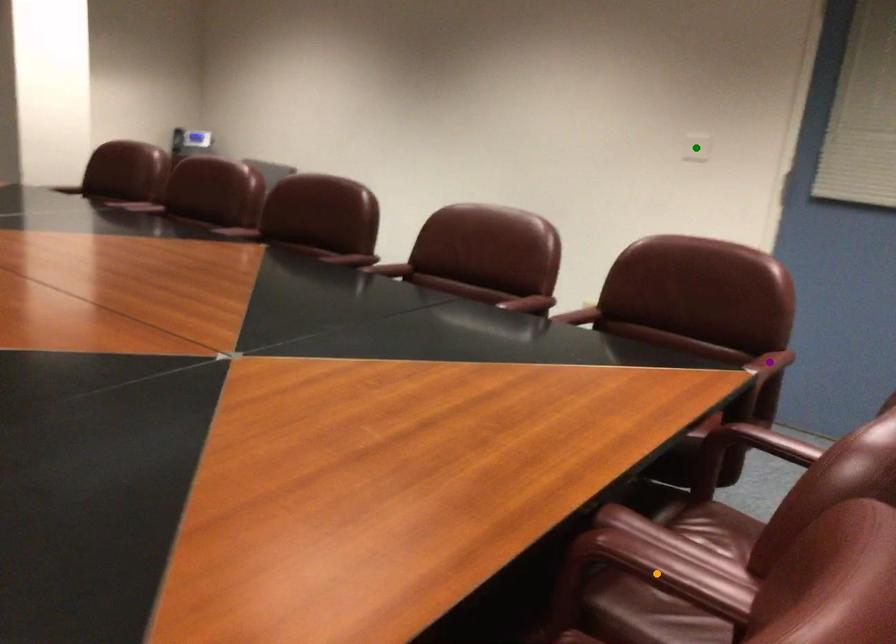
Order these from nearest to farthest:
orange point, purple point, green point

orange point
purple point
green point